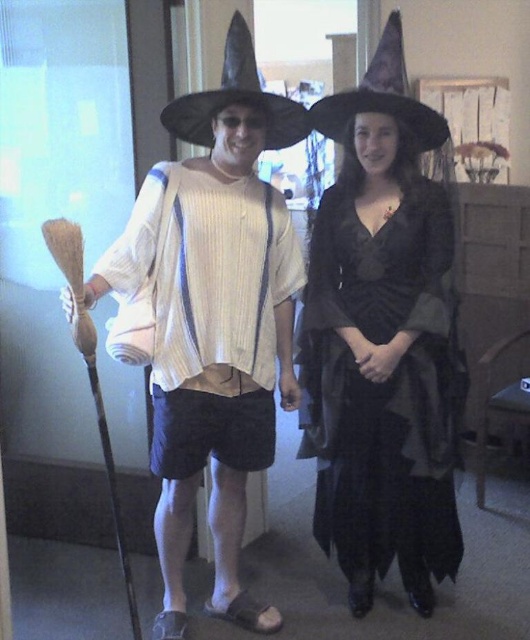
You are a photographer trying to capture both black felt witch hat at center and black felt witch hat at upper center in a single shot. Which hat should you focus on first to ensure both are in focus?

You should focus on the black felt witch hat at center first since it is closer to the viewer, ensuring both hats are in focus when using depth of field properly.

Consider the image. You are a costume designer preparing for a Halloween party. You have two black felt witch hats available. The first is labeled as the black felt witch hat at center, and the second is labeled as the black felt witch hat at upper center. Which of these two hats is larger in size?

The black felt witch hat at center is bigger than the black felt witch hat at upper center, so the larger hat is the black felt witch hat at center.